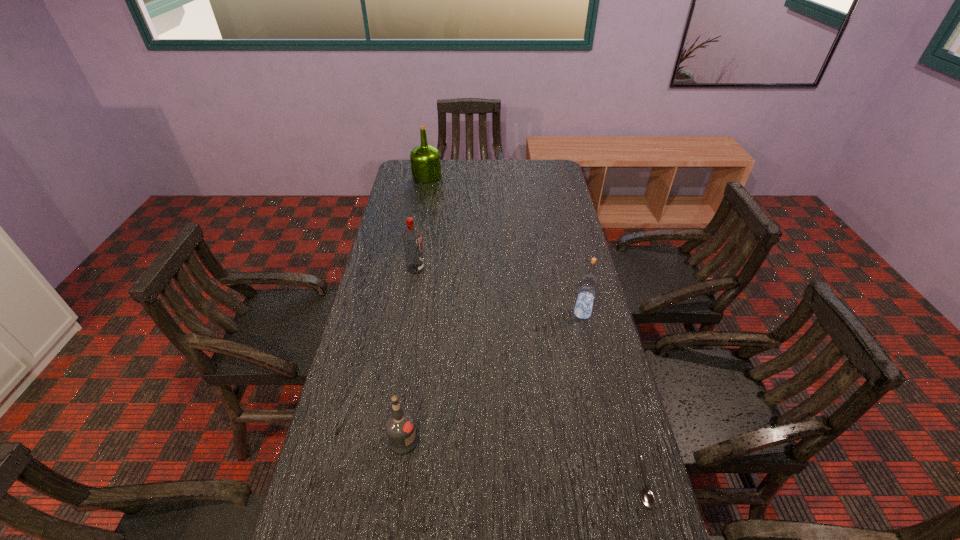
The width and height of the screenshot is (960, 540). Identify the location of vacant area that satisfies the following two spatial constraints: 1. on the front label of the shortest object; 2. on the left side of the fourth farthest object. (397, 483).

The height and width of the screenshot is (540, 960). I want to click on vacant area in the image that satisfies the following two spatial constraints: 1. on the front label of the farthest vodka; 2. on the left side of the rightmost object, so click(x=380, y=483).

In order to click on free space that satisfies the following two spatial constraints: 1. on the front label of the second nearest vodka; 2. on the right side of the farthest vodka in this screenshot , I will do `click(408, 313)`.

I want to click on vacant space that satisfies the following two spatial constraints: 1. on the back side of the nearest object; 2. on the front label of the nearest vodka, so click(631, 441).

Identify the location of free point that satisfies the following two spatial constraints: 1. on the front label of the nearest object; 2. on the right side of the fourth nearest object. (380, 483).

Find the location of a particular element. The width and height of the screenshot is (960, 540). vacant position in the image that satisfies the following two spatial constraints: 1. on the front label of the fourth farthest object; 2. on the right side of the nearest object is located at coordinates (397, 483).